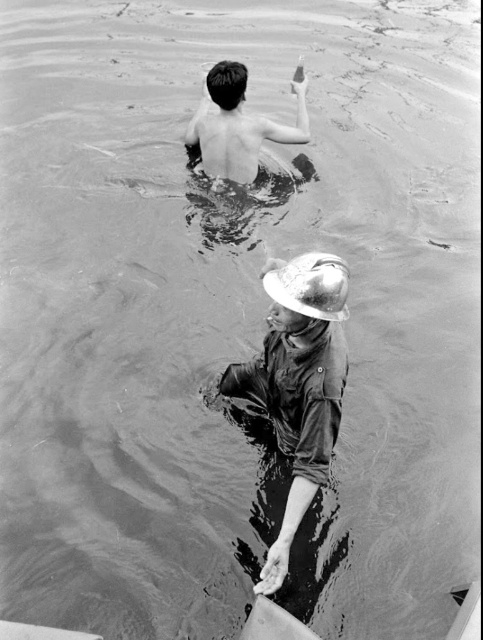
Question: Which point is farther to the camera?

Choices:
 (A) shiny metallic helmet at center
 (B) shiny skin at upper center

Answer: (B)

Question: Among these objects, which one is nearest to the camera?

Choices:
 (A) shiny skin at upper center
 (B) shiny metallic helmet at center

Answer: (B)

Question: Is shiny metallic helmet at center bigger than shiny skin at upper center?

Choices:
 (A) no
 (B) yes

Answer: (A)

Question: Which object is farther from the camera taking this photo?

Choices:
 (A) shiny skin at upper center
 (B) shiny metallic helmet at center

Answer: (A)

Question: Is shiny metallic helmet at center positioned at the back of shiny skin at upper center?

Choices:
 (A) no
 (B) yes

Answer: (A)

Question: Is shiny metallic helmet at center smaller than shiny skin at upper center?

Choices:
 (A) yes
 (B) no

Answer: (A)